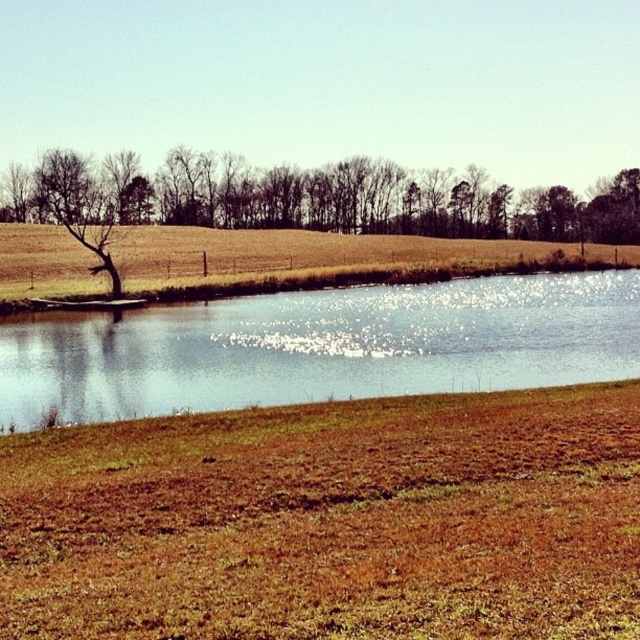
Can you confirm if blue glassy lake at center is wider than brown grassy field at center?

Incorrect, blue glassy lake at center's width does not surpass brown grassy field at center's.

Is blue glassy lake at center bigger than brown grassy field at center?

Incorrect, blue glassy lake at center is not larger than brown grassy field at center.

Where is `blue glassy lake at center`? blue glassy lake at center is located at coordinates (321, 346).

Looking at this image, who is taller, brown soil at lower center or blue glassy lake at center?

With more height is blue glassy lake at center.

You are a GUI agent. You are given a task and a screenshot of the screen. Output one action in this format:
    pyautogui.click(x=<x>, y=<y>)
    Task: Click on the brown soil at lower center
    The image size is (640, 640).
    Given the screenshot: What is the action you would take?
    click(x=330, y=522)

How much distance is there between brown soil at lower center and brown grassy field at center?

They are 82.51 meters apart.

Does brown soil at lower center have a greater width compared to brown grassy field at center?

No, brown soil at lower center is not wider than brown grassy field at center.

Is point (216, 508) behind point (291, 282)?

No, (216, 508) is in front of (291, 282).

Locate an element on the screen. This screenshot has height=640, width=640. brown soil at lower center is located at coordinates (330, 522).